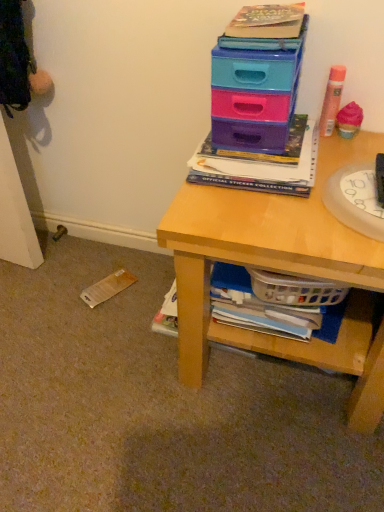
I want to click on vacant space situated on the left part of transparent plastic plate at right, so click(275, 215).